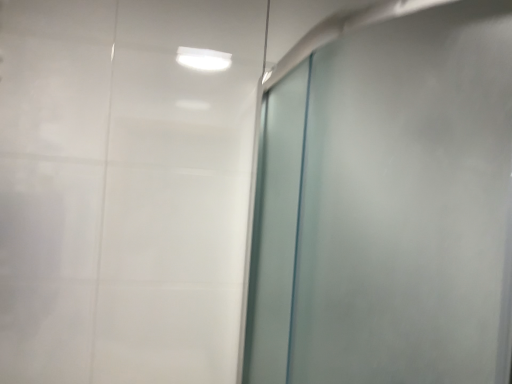
This screenshot has width=512, height=384. Describe the element at coordinates (386, 201) in the screenshot. I see `frosted glass door at right` at that location.

What is the approximate width of frosted glass door at right?

The width of frosted glass door at right is 87.28 centimeters.

The image size is (512, 384). I want to click on frosted glass door at right, so click(386, 201).

Locate an element on the screen. frosted glass door at right is located at coordinates (386, 201).